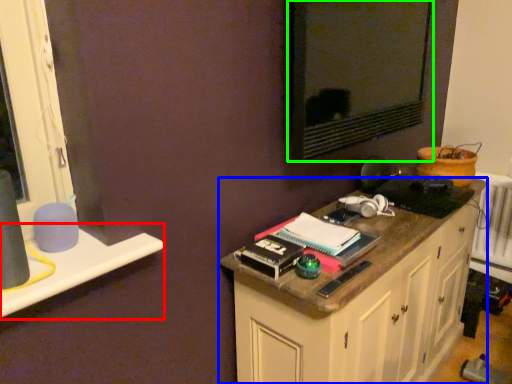
Question: Based on their relative distances, which object is farther from window sill (highlighted by a red box)? Choose from cabinetry (highlighted by a blue box) and wide (highlighted by a green box).

Choices:
 (A) cabinetry
 (B) wide

Answer: (B)